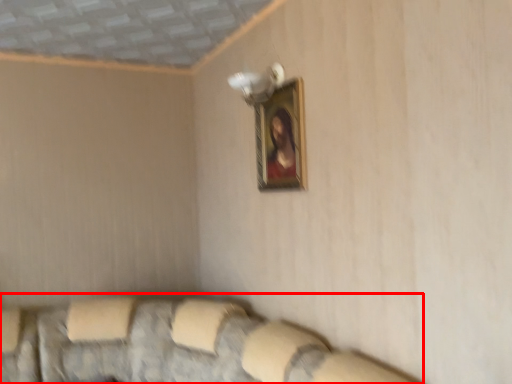
Question: In this image, where is couch (annotated by the red box) located relative to picture frame?

Choices:
 (A) right
 (B) left

Answer: (B)